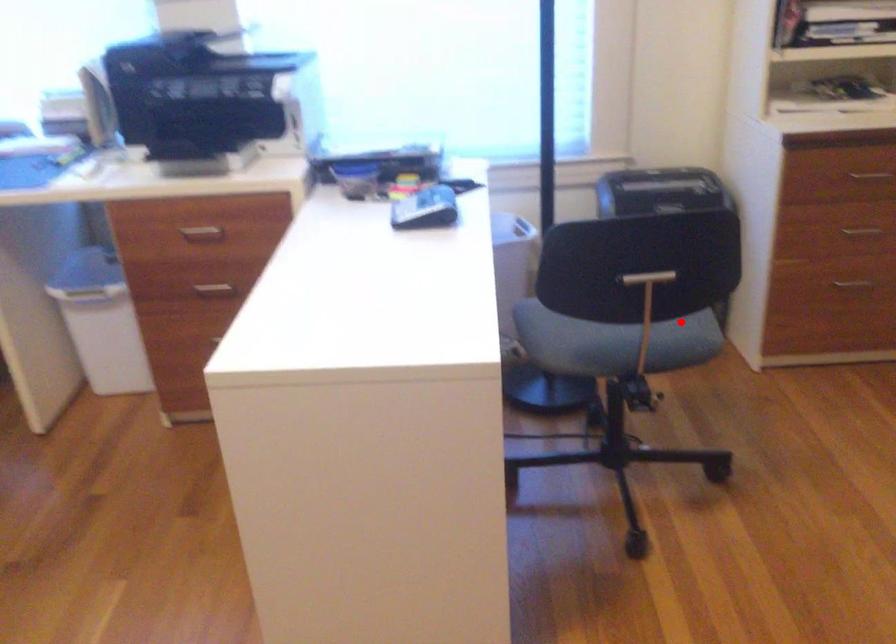
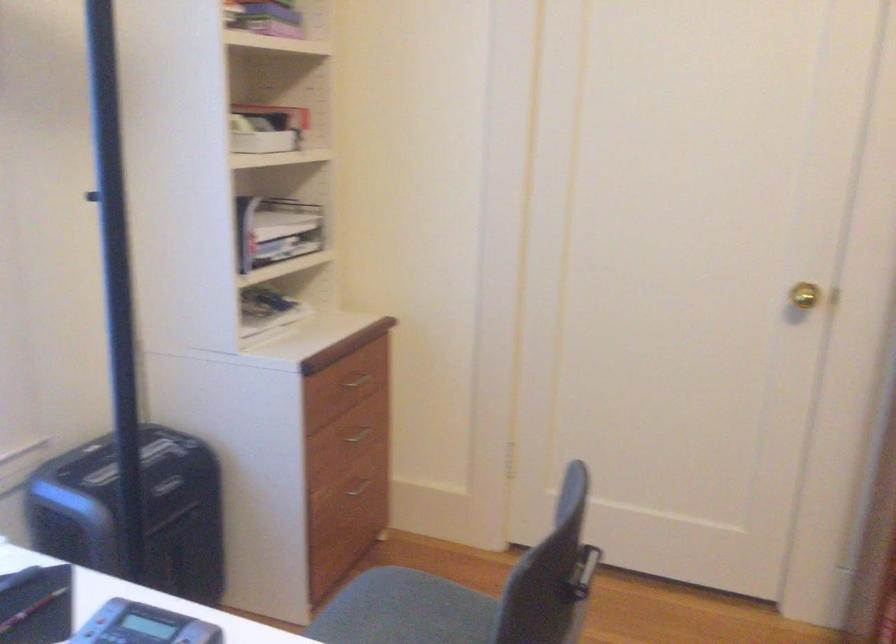
Question: I am providing you with two images of the same scene from different viewpoints. Image1 has a red point marked. In image2, the corresponding 3D location appears at what relative position? Reply with the corresponding letter.

Choices:
 (A) Closer
 (B) Farther

Answer: (A)